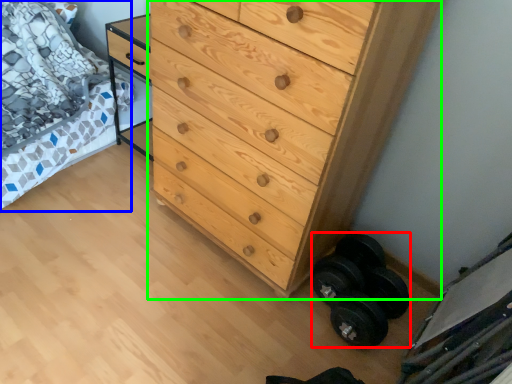
Question: Which object is positioned closest to dumbbell (highlighted by a red box)? Select from bed (highlighted by a blue box) and chest of drawers (highlighted by a green box).

Choices:
 (A) bed
 (B) chest of drawers

Answer: (B)